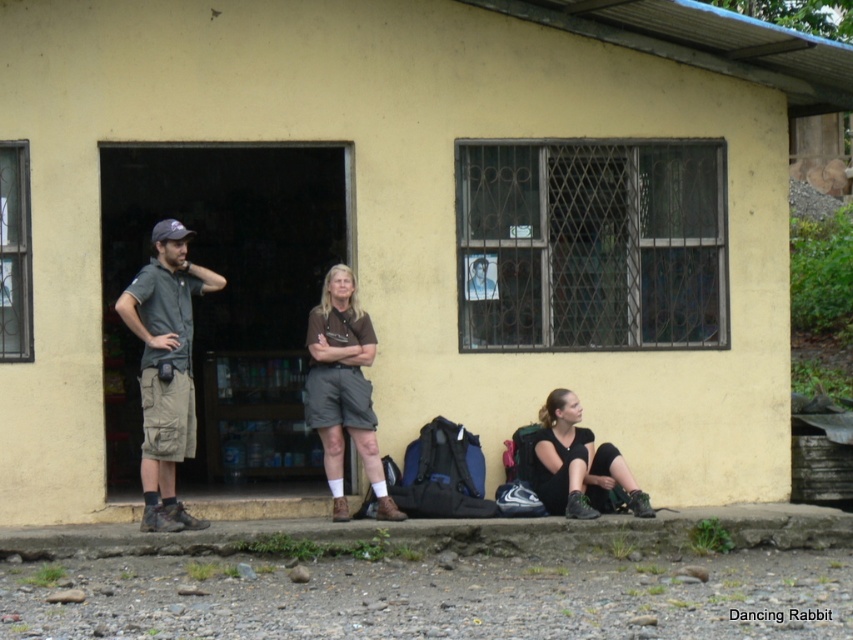
You are a photographer setting up for a group photo. You need to position the dark gray fabric shirt at left and the black matte leggings at lower right so that they are both visible in the frame. Based on their current positions, which direction should you move the camera to include both subjects without cropping either?

Since the dark gray fabric shirt at left is to the left of the black matte leggings at lower right, you should move the camera to the right to ensure both subjects are fully visible in the frame.

You are standing in front of the building and want to place a small plant pot between the two points, point (165, 509) and point (367, 442). Which point should the pot be closer to in order to be nearer to the building?

The pot should be closer to point (367, 442) because it is farther from the viewer compared to point (165, 509), making it nearer to the building.

You are trying to determine the clothing sizes of two people in the image. The dark gray fabric shirt at left and the black matte leggings at lower right are visible. Which clothing item is bigger in size?

The dark gray fabric shirt at left is larger in size than the black matte leggings at lower right.